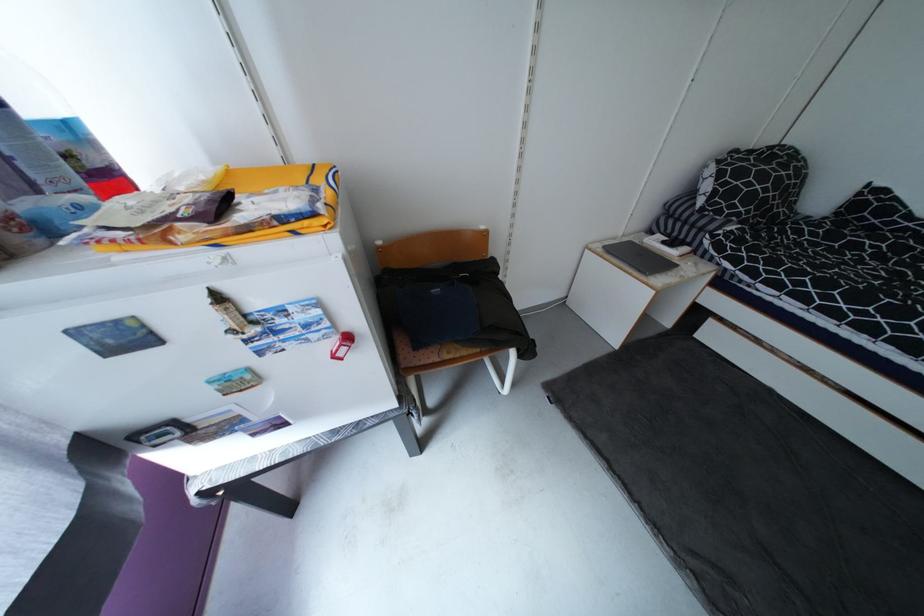
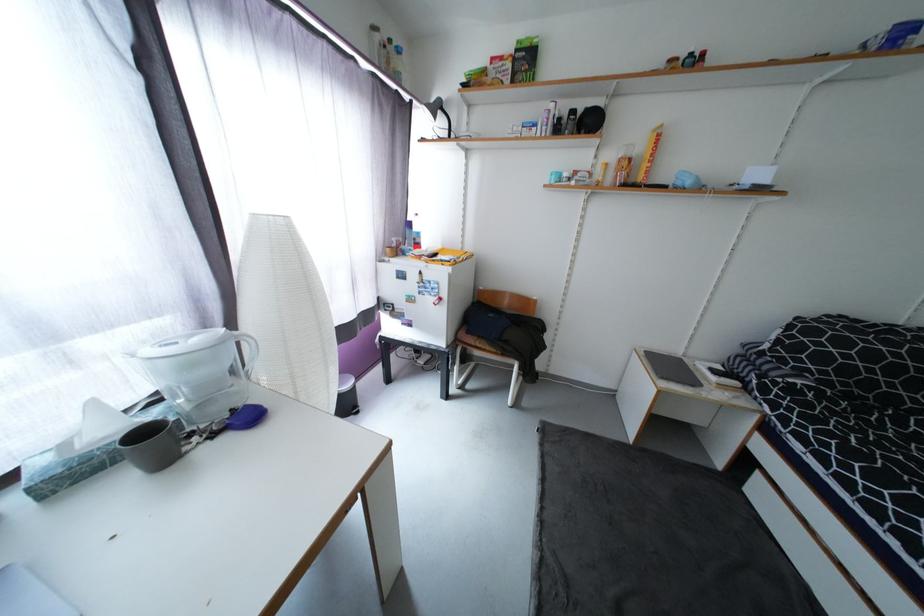
In the second image, find the point that corresponds to the point at 469,354 in the first image.

(493, 349)